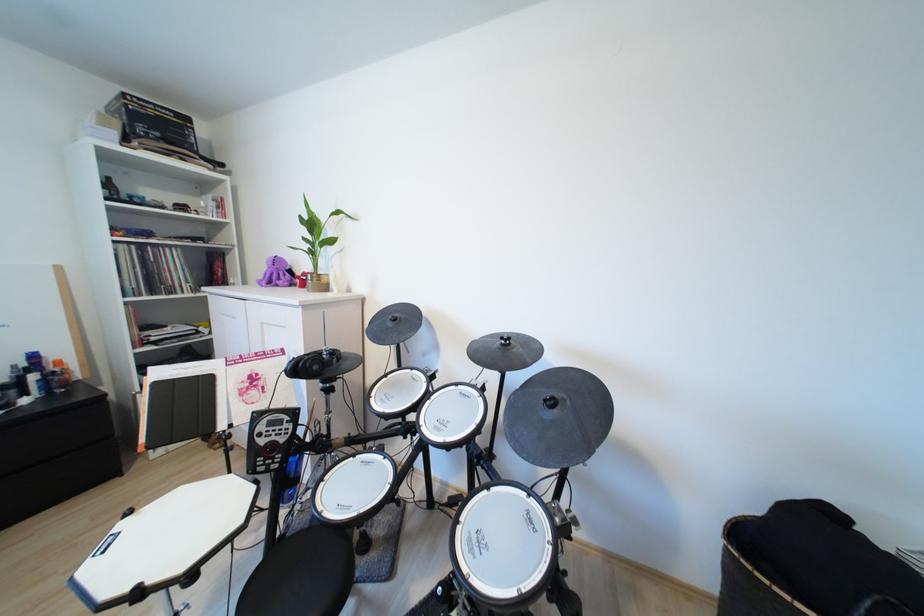
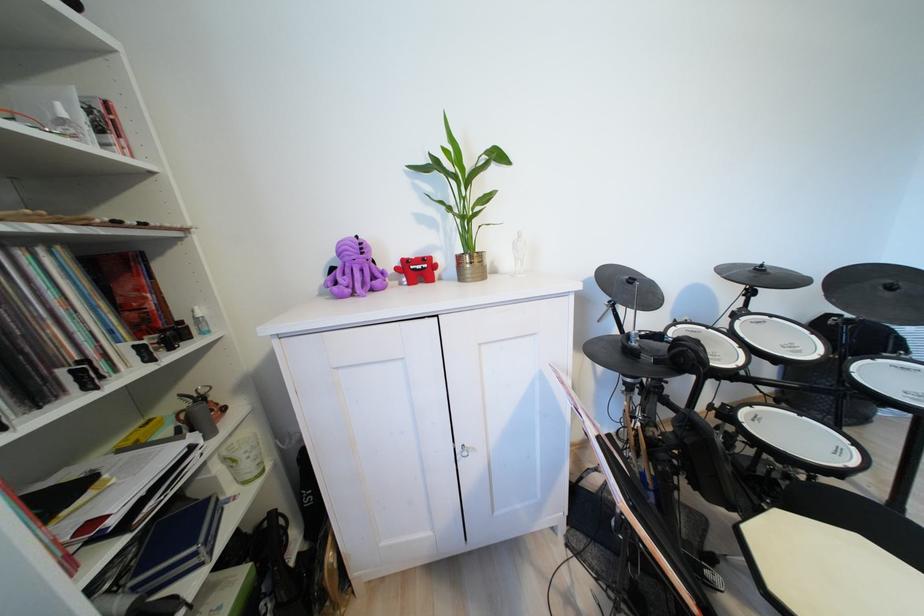
Locate, in the second image, the point that corresponds to (289,277) in the first image.

(360, 274)